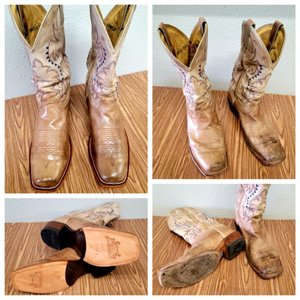
At what (x,y) coordinates should I click in order to perform the action: click on table top. Please return your answer as a coordinate pair (x, y). The height and width of the screenshot is (300, 300). Looking at the image, I should click on (126, 282).